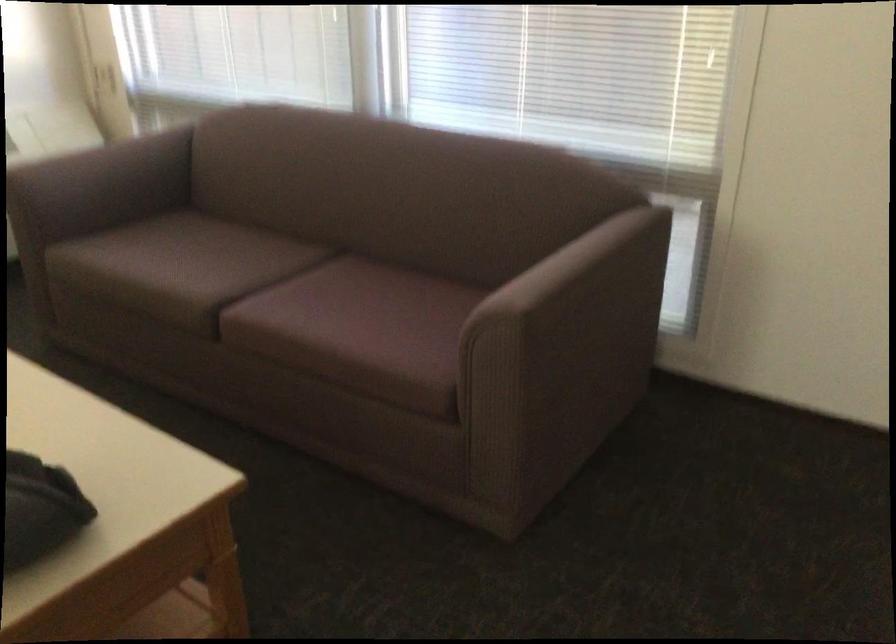
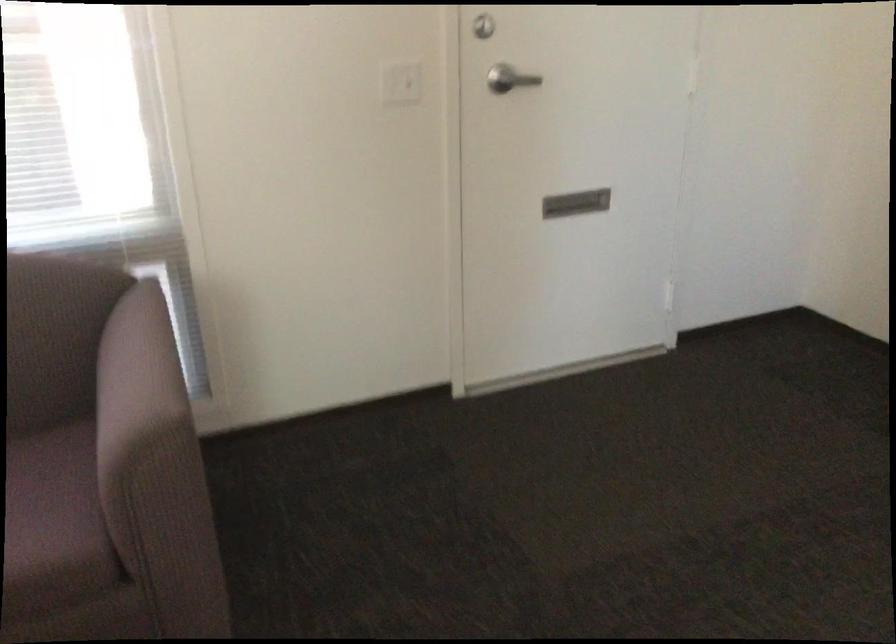
Question: The camera is either moving clockwise (left) or counter-clockwise (right) around the object. The first image is from the beginning of the video and the second image is from the end. Is the camera moving left or right when shooting the video?

Choices:
 (A) Left
 (B) Right

Answer: (A)